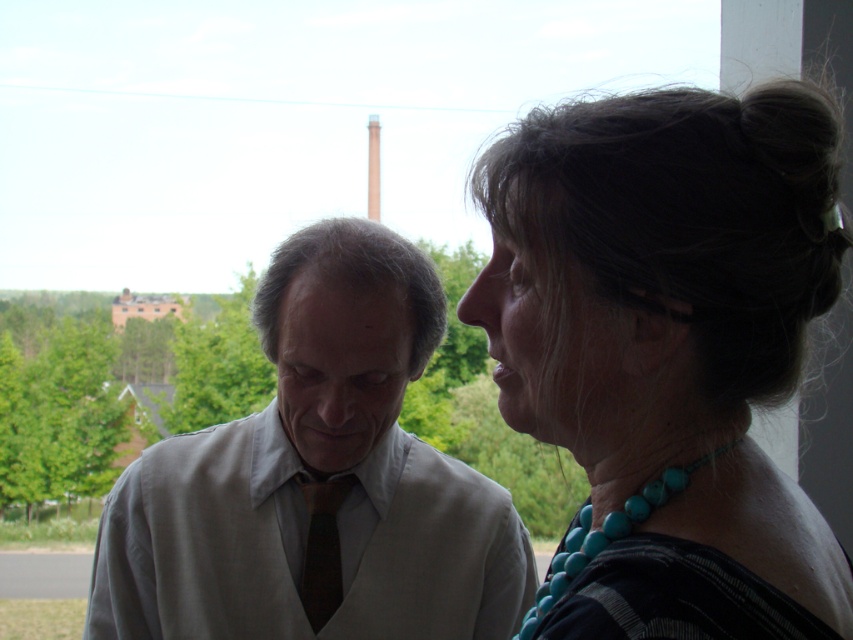
Does turquoise beaded necklace at upper right have a greater height compared to dark brown silk tie at center?

Correct, turquoise beaded necklace at upper right is much taller as dark brown silk tie at center.

From the picture: Is turquoise beaded necklace at upper right thinner than dark brown silk tie at center?

Incorrect, turquoise beaded necklace at upper right's width is not less than dark brown silk tie at center's.

Who is more forward, (505, 241) or (300, 580)?

Point (505, 241)

Locate an element on the screen. turquoise beaded necklace at upper right is located at coordinates (670, 348).

Is the position of light beige fabric shirt at center less distant than that of turquoise beads at right?

No.

Does light beige fabric shirt at center have a smaller size compared to turquoise beads at right?

Actually, light beige fabric shirt at center might be larger than turquoise beads at right.

Who is more distant from viewer, (367,509) or (563,563)?

The point (367,509) is behind.

Locate an element on the screen. light beige fabric shirt at center is located at coordinates (317, 481).

Can you confirm if light beige fabric shirt at center is smaller than dark brown silk tie at center?

No, light beige fabric shirt at center is not smaller than dark brown silk tie at center.

Does light beige fabric shirt at center appear on the right side of dark brown silk tie at center?

No, light beige fabric shirt at center is not to the right of dark brown silk tie at center.

Identify the location of light beige fabric shirt at center. (317, 481).